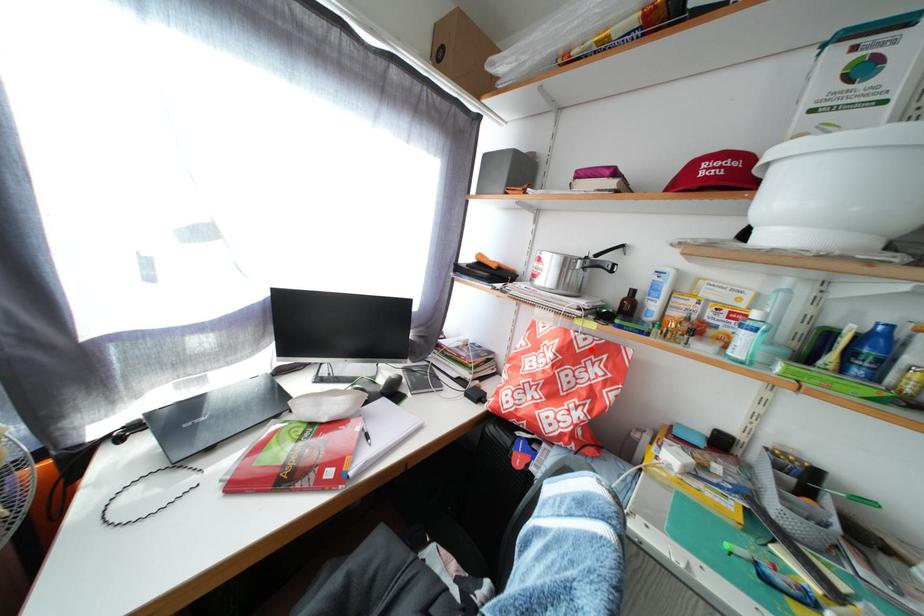
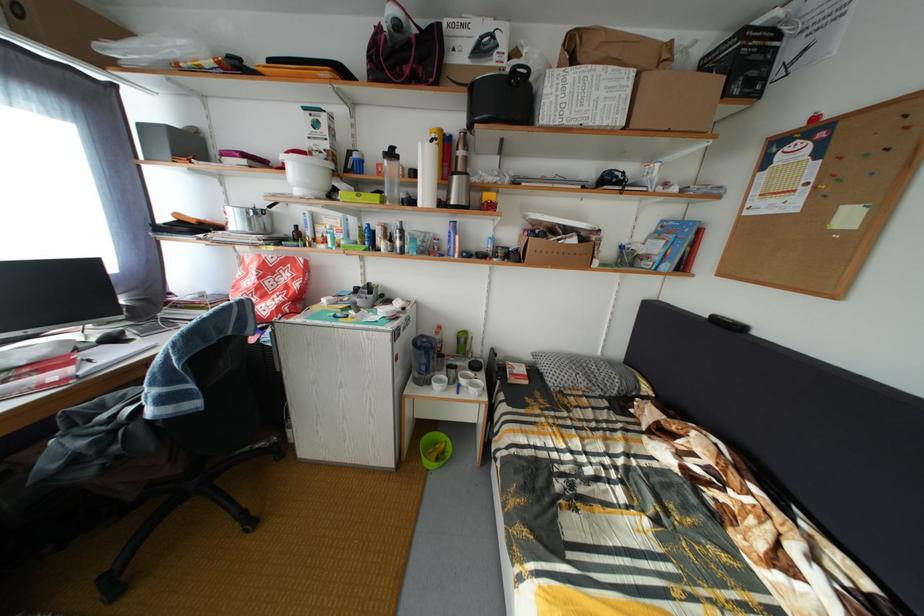
The point at the highlighted location is marked in the first image. Where is the corresponding point in the second image?

(281, 267)